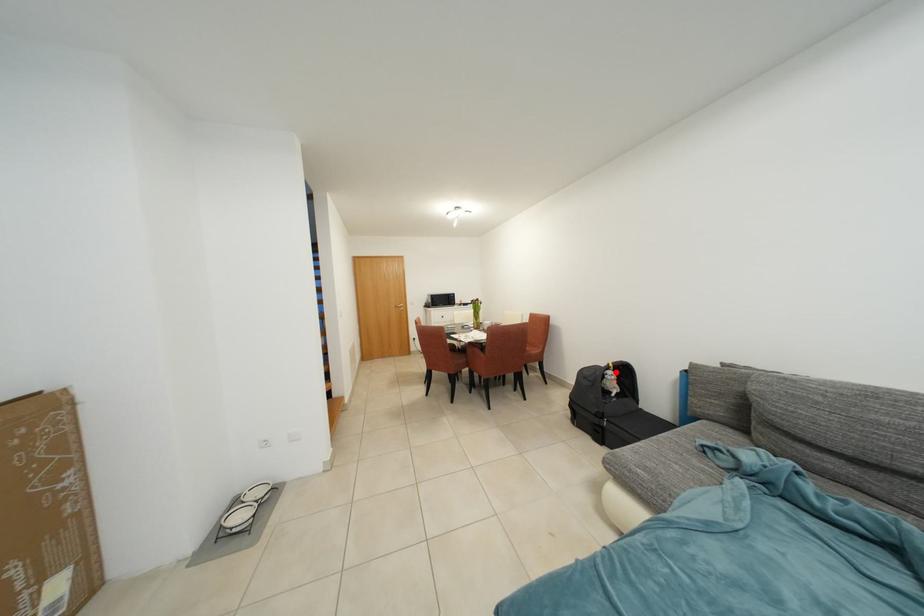
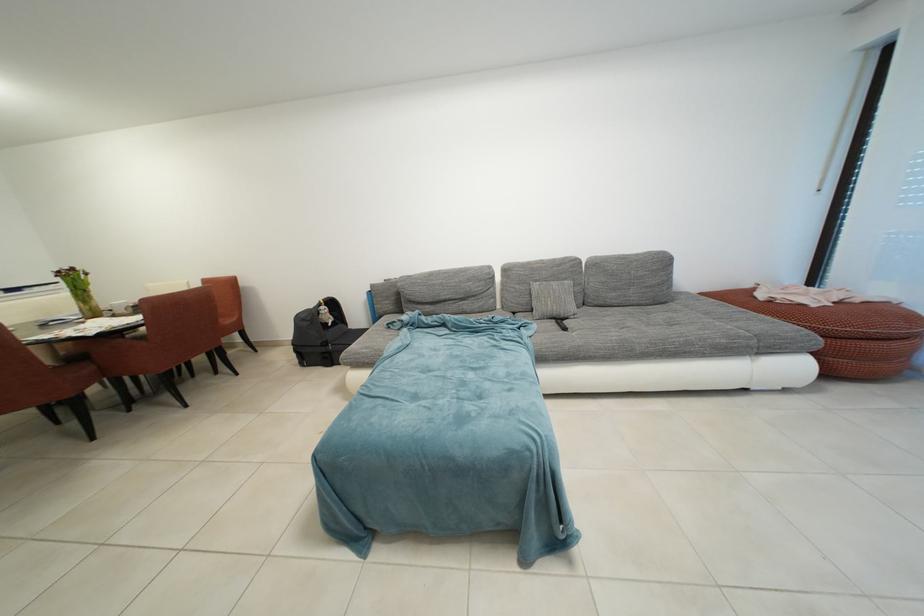
Question: I am providing you with two images of the same scene from different viewpoints. Given a red point in image1, look at the same physical point in image2. Is it:

Choices:
 (A) Closer to the viewpoint
 (B) Farther from the viewpoint

Answer: (A)